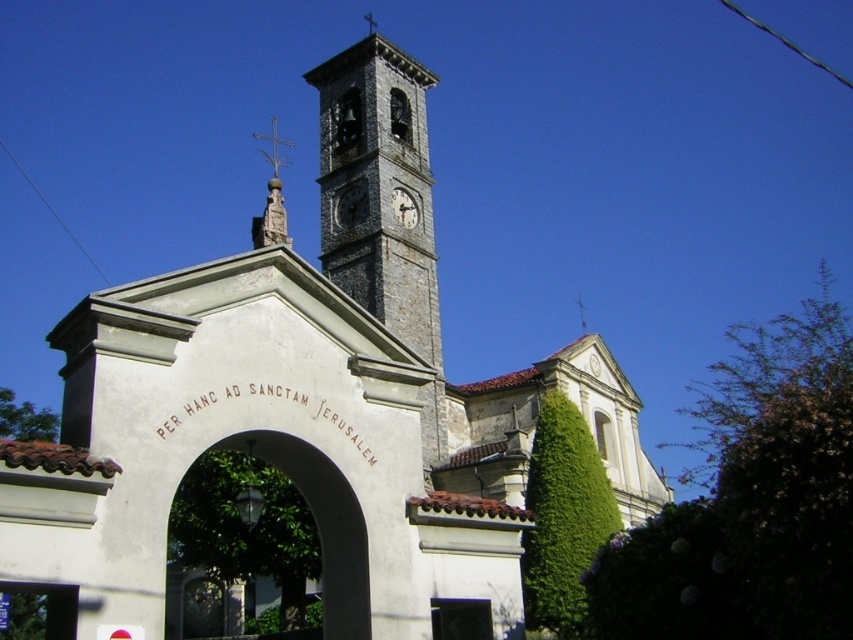
You are an architect designing a new church and want to ensure the stone clock tower at center is proportionate to the gray stone clock at center. According to the image, which one is taller?

The stone clock tower at center is taller than the gray stone clock at center.

You are an architect designing a new church and want to ensure the polished gold cross at center and the gray stone clock at center are proportionate. Based on the scene, which object should be placed higher in your design?

The polished gold cross at center is taller than the gray stone clock at center in the scene, so in the design, the polished gold cross at center should be placed higher than the gray stone clock at center to maintain proportionality.

You are standing in front of the historic church and notice two structures. The first is the stone clock tower at center, and the second is the gray stone clock at center. According to their positions, which one is located to the left?

The stone clock tower at center is located to the left of the gray stone clock at center.